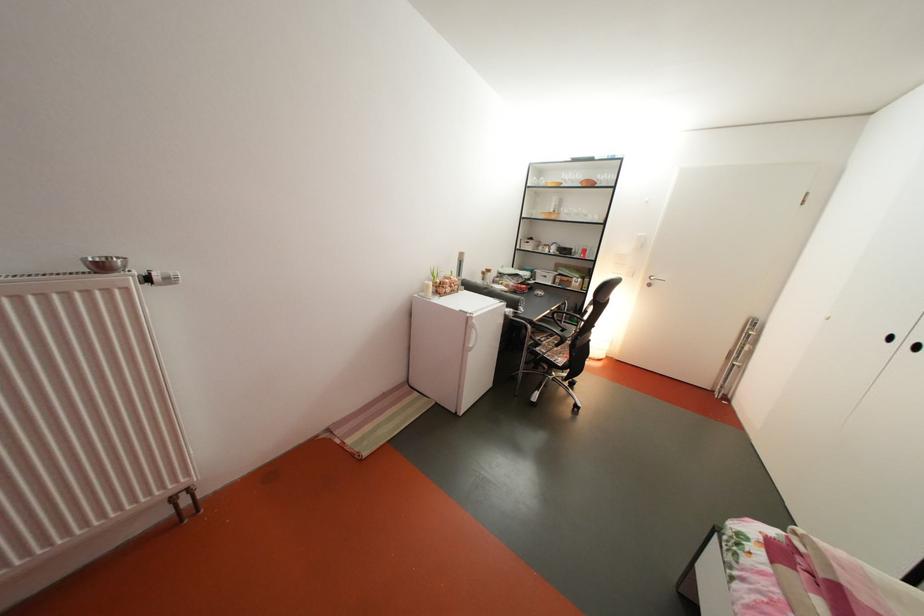
Image resolution: width=924 pixels, height=616 pixels. I want to click on silver door handle, so click(x=652, y=280).